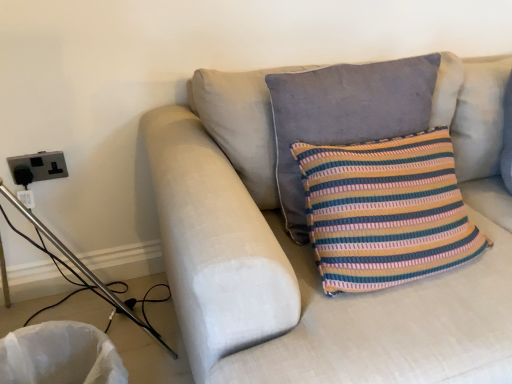
Question: Is light beige fabric couch at center taller than black plastic outlet at left?

Choices:
 (A) no
 (B) yes

Answer: (B)

Question: Is light beige fabric couch at center beside black plastic outlet at left?

Choices:
 (A) yes
 (B) no

Answer: (B)

Question: Considering the relative sizes of light beige fabric couch at center and black plastic outlet at left in the image provided, is light beige fabric couch at center bigger than black plastic outlet at left?

Choices:
 (A) no
 (B) yes

Answer: (B)

Question: Is light beige fabric couch at center to the right of black plastic outlet at left from the viewer's perspective?

Choices:
 (A) no
 (B) yes

Answer: (B)

Question: Are light beige fabric couch at center and black plastic outlet at left far apart?

Choices:
 (A) no
 (B) yes

Answer: (A)

Question: Is light beige fabric couch at center looking in the opposite direction of black plastic outlet at left?

Choices:
 (A) no
 (B) yes

Answer: (A)

Question: From a real-world perspective, is black plastic outlet at left positioned under light beige fabric couch at center based on gravity?

Choices:
 (A) yes
 (B) no

Answer: (B)

Question: Is black plastic outlet at left far away from light beige fabric couch at center?

Choices:
 (A) yes
 (B) no

Answer: (B)

Question: From a real-world perspective, is black plastic outlet at left physically above light beige fabric couch at center?

Choices:
 (A) no
 (B) yes

Answer: (B)

Question: Considering the relative positions of black plastic outlet at left and light beige fabric couch at center in the image provided, is black plastic outlet at left to the right of light beige fabric couch at center from the viewer's perspective?

Choices:
 (A) yes
 (B) no

Answer: (B)

Question: From the image's perspective, is black plastic outlet at left located beneath light beige fabric couch at center?

Choices:
 (A) yes
 (B) no

Answer: (B)

Question: From the image's perspective, is black plastic outlet at left on light beige fabric couch at center?

Choices:
 (A) no
 (B) yes

Answer: (B)

Question: Is light beige fabric couch at center thinner than striped fabric pillow at center, marked as the second pillow in a right-to-left arrangement?

Choices:
 (A) yes
 (B) no

Answer: (B)